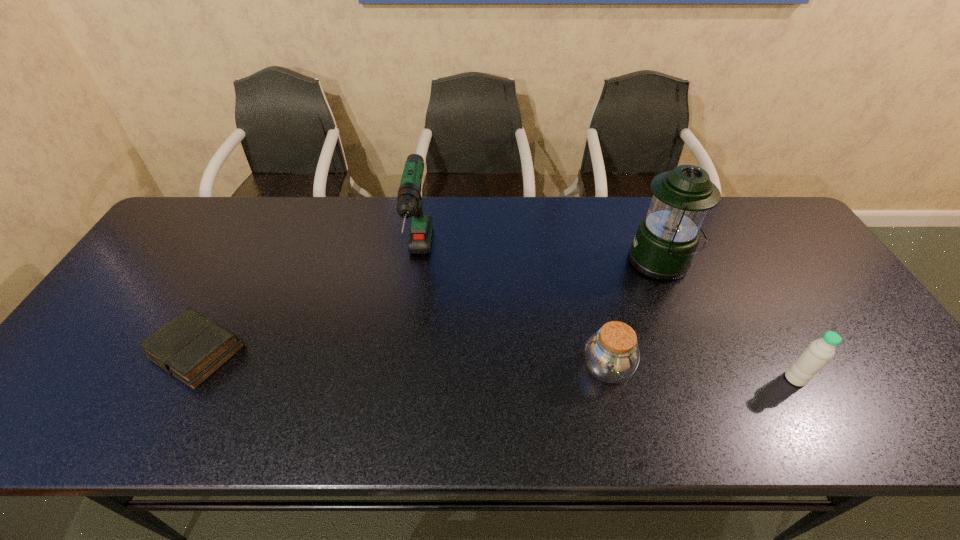
Identify the location of the second object from right to left. (667, 237).

At what (x,y) coordinates should I click in order to perform the action: click on the second object from left to right. Please return your answer as a coordinate pair (x, y). Looking at the image, I should click on (409, 201).

At what (x,y) coordinates should I click in order to perform the action: click on the rightmost object. Please return your answer as a coordinate pair (x, y). Looking at the image, I should click on (819, 352).

Identify the location of the third shortest object. (819, 352).

At what (x,y) coordinates should I click in order to perform the action: click on jar. Please return your answer as a coordinate pair (x, y). The image size is (960, 540). Looking at the image, I should click on (612, 355).

You are a GUI agent. You are given a task and a screenshot of the screen. Output one action in this format:
    pyautogui.click(x=<x>, y=<y>)
    Task: Click on the fourth tallest object
    Image resolution: width=960 pixels, height=540 pixels.
    Given the screenshot: What is the action you would take?
    pyautogui.click(x=612, y=355)

This screenshot has width=960, height=540. I want to click on the shortest object, so click(x=191, y=347).

Locate an element on the screen. book is located at coordinates (191, 347).

You are a GUI agent. You are given a task and a screenshot of the screen. Output one action in this format:
    pyautogui.click(x=<x>, y=<y>)
    Task: Click on the vacant space located on the back of the fourth object from left to right
    The height and width of the screenshot is (540, 960).
    Given the screenshot: What is the action you would take?
    pyautogui.click(x=646, y=225)

Locate an element on the screen. free space located 0.190m on the handle side of the fourth object from right to left is located at coordinates (405, 360).